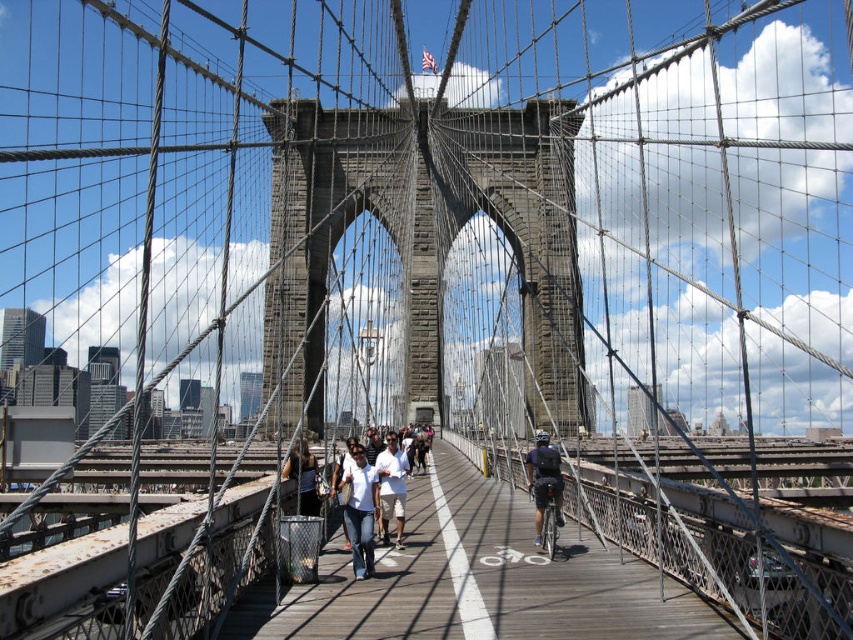
You are a tourist standing on the Brooklyn Bridge and want to take a photo of the wooden walkway at center and denim pants at center. Which object should you focus on if you want to capture the larger one in your shot?

The wooden walkway at center is bigger than denim pants at center, so you should focus on the wooden walkway at center to capture the larger one in your shot.

You are standing on the Brooklyn Bridge and want to cross to the other side. The wooden walkway at center is where pedestrians walk. Based on the coordinates provided, where exactly should you step to stay on the designated path?

The wooden walkway at center is located at point (x=479, y=579), so you should step there to stay on the designated path.

You are standing on the Brooklyn Bridge and want to place a 1.2 meter long wooden bench on the wooden walkway at center. Can the bench fit on the walkway without overhanging? Mention the dark blue jeans at center in your answer.

The wooden walkway at center is shorter than the dark blue jeans at center, but since the length of the dark blue jeans isn at provided, we cannot determine if the bench will fit. Please provide more information about the dark blue jeans at center.